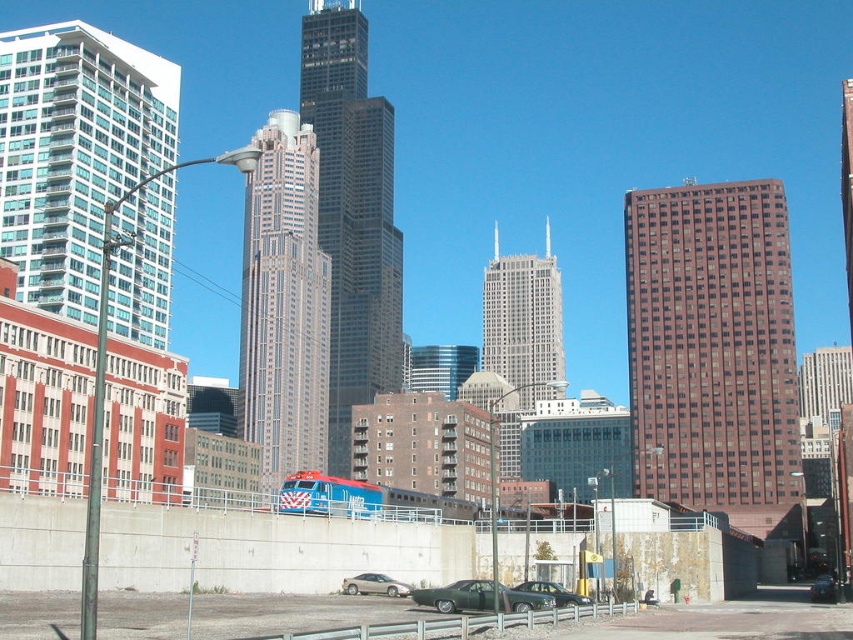
Question: Which of these objects is positioned closest to the shiny black car at center?

Choices:
 (A) brown glass building at right
 (B) silver metallic sedan at lower center
 (C) glassy teal skyscraper at upper left
 (D) metallic green car at lower center

Answer: (D)

Question: Based on their relative distances, which object is nearer to the silver metallic sedan at lower center?

Choices:
 (A) shiny black sedan at center
 (B) brown glass building at right

Answer: (A)

Question: Is the position of glassy steel skyscraper at center less distant than that of gray glass skyscraper at center?

Choices:
 (A) yes
 (B) no

Answer: (B)

Question: Which is farther from the shiny black car at center?

Choices:
 (A) glassy steel skyscraper at center
 (B) gray glass skyscraper at center

Answer: (A)

Question: Is glassy teal skyscraper at upper left thinner than white glass skyscraper at center?

Choices:
 (A) no
 (B) yes

Answer: (B)

Question: Does shiny black car at center have a lesser width compared to metallic green car at lower center?

Choices:
 (A) yes
 (B) no

Answer: (B)